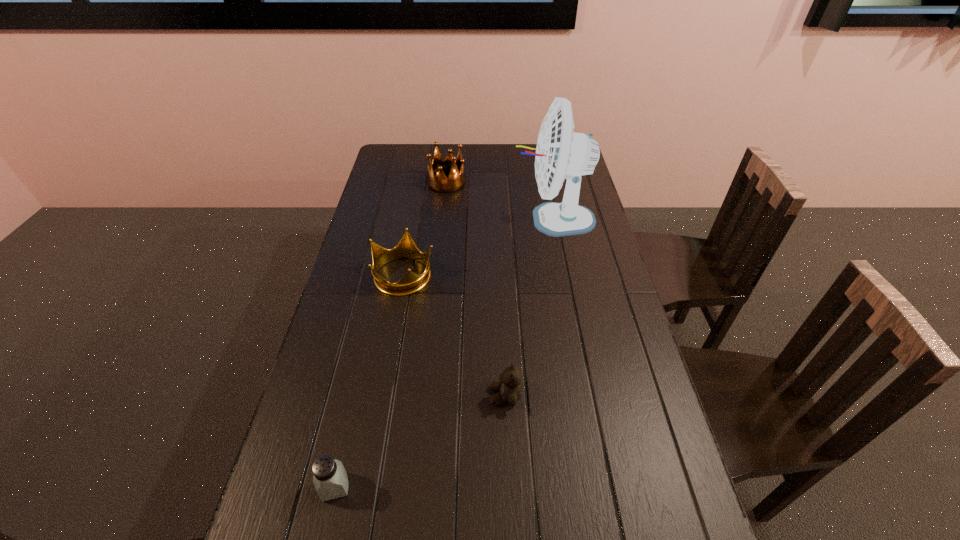
You are a GUI agent. You are given a task and a screenshot of the screen. Output one action in this format:
    pyautogui.click(x=<x>, y=<y>)
    Task: Click on the tallest object
    The width and height of the screenshot is (960, 540).
    Given the screenshot: What is the action you would take?
    pyautogui.click(x=561, y=153)

Identify the location of fan. The width and height of the screenshot is (960, 540). (561, 153).

Where is `the taller crown`? This screenshot has height=540, width=960. the taller crown is located at coordinates (456, 180).

At what (x,y) coordinates should I click in order to perform the action: click on the second tallest object. Please return your answer as a coordinate pair (x, y). This screenshot has height=540, width=960. Looking at the image, I should click on tap(456, 180).

Locate an element on the screen. The image size is (960, 540). the second object from right to left is located at coordinates (509, 387).

Locate an element on the screen. The width and height of the screenshot is (960, 540). the fourth farthest object is located at coordinates (509, 387).

The height and width of the screenshot is (540, 960). Find the location of `the third nearest object`. the third nearest object is located at coordinates (411, 282).

The width and height of the screenshot is (960, 540). I want to click on the nearer crown, so 411,282.

Identify the location of the nearest object. (330, 479).

At what (x,y) coordinates should I click in order to perform the action: click on vacant position located 0.330m on the grille of the fourth nearest object. Please return your answer as a coordinate pair (x, y). Looking at the image, I should click on (421, 220).